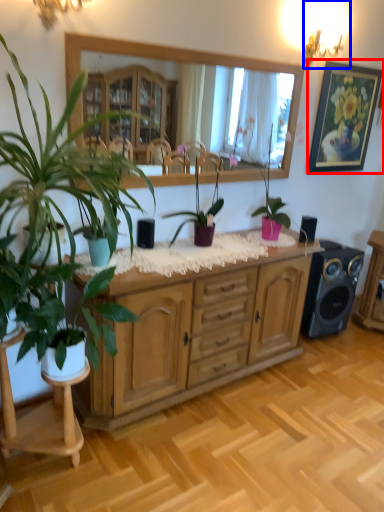
Question: Among these objects, which one is nearest to the camera, picture frame (highlighted by a red box) or lamp (highlighted by a blue box)?

Choices:
 (A) picture frame
 (B) lamp

Answer: (B)